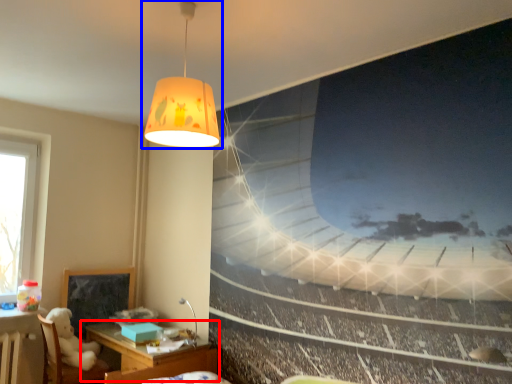
Question: Among these objects, which one is farthest to the camera, table (highlighted by a red box) or lamp (highlighted by a blue box)?

Choices:
 (A) table
 (B) lamp

Answer: (A)